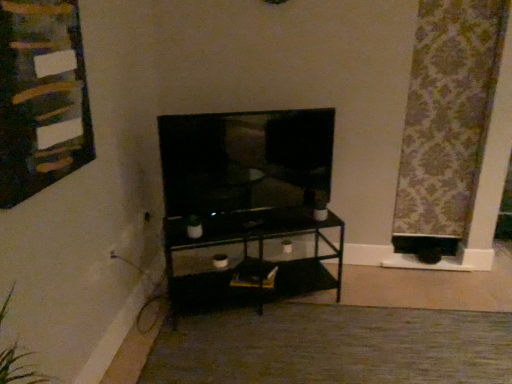
Question: Would you say matte black tv at center is outside carpet at center?

Choices:
 (A) no
 (B) yes

Answer: (B)

Question: From a real-world perspective, is matte black tv at center located higher than carpet at center?

Choices:
 (A) no
 (B) yes

Answer: (B)

Question: Does matte black tv at center lie in front of carpet at center?

Choices:
 (A) no
 (B) yes

Answer: (A)

Question: Considering the relative sizes of matte black tv at center and carpet at center in the image provided, is matte black tv at center thinner than carpet at center?

Choices:
 (A) yes
 (B) no

Answer: (A)

Question: Is matte black tv at center oriented towards carpet at center?

Choices:
 (A) yes
 (B) no

Answer: (B)

Question: Considering the positions of patterned fabric curtain at right and carpet at center in the image, is patterned fabric curtain at right wider or thinner than carpet at center?

Choices:
 (A) wide
 (B) thin

Answer: (B)

Question: Relative to carpet at center, is patterned fabric curtain at right in front or behind?

Choices:
 (A) behind
 (B) front

Answer: (A)

Question: From the image's perspective, is patterned fabric curtain at right above or below carpet at center?

Choices:
 (A) above
 (B) below

Answer: (A)

Question: Visually, is patterned fabric curtain at right positioned to the left or to the right of carpet at center?

Choices:
 (A) right
 (B) left

Answer: (A)

Question: Is wooden bulletin board at upper left inside or outside of carpet at center?

Choices:
 (A) inside
 (B) outside

Answer: (B)

Question: From a real-world perspective, relative to carpet at center, is wooden bulletin board at upper left vertically above or below?

Choices:
 (A) below
 (B) above

Answer: (B)

Question: Is point (22, 137) closer or farther from the camera than point (309, 309)?

Choices:
 (A) closer
 (B) farther

Answer: (A)

Question: Considering the positions of wooden bulletin board at upper left and carpet at center in the image, is wooden bulletin board at upper left wider or thinner than carpet at center?

Choices:
 (A) thin
 (B) wide

Answer: (A)

Question: Considering the positions of wooden bulletin board at upper left and matte black tv at center in the image, is wooden bulletin board at upper left wider or thinner than matte black tv at center?

Choices:
 (A) wide
 (B) thin

Answer: (B)

Question: Is wooden bulletin board at upper left taller or shorter than matte black tv at center?

Choices:
 (A) tall
 (B) short

Answer: (A)